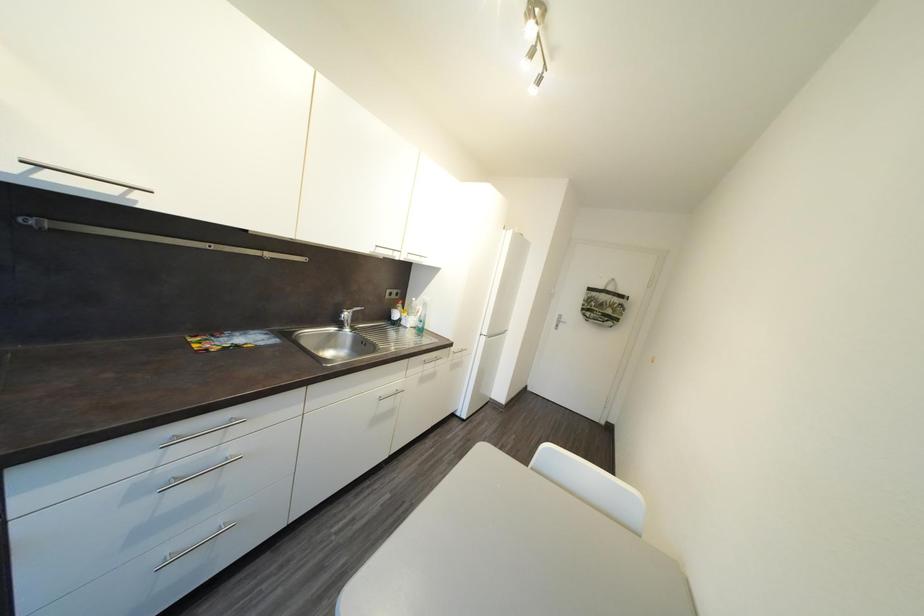
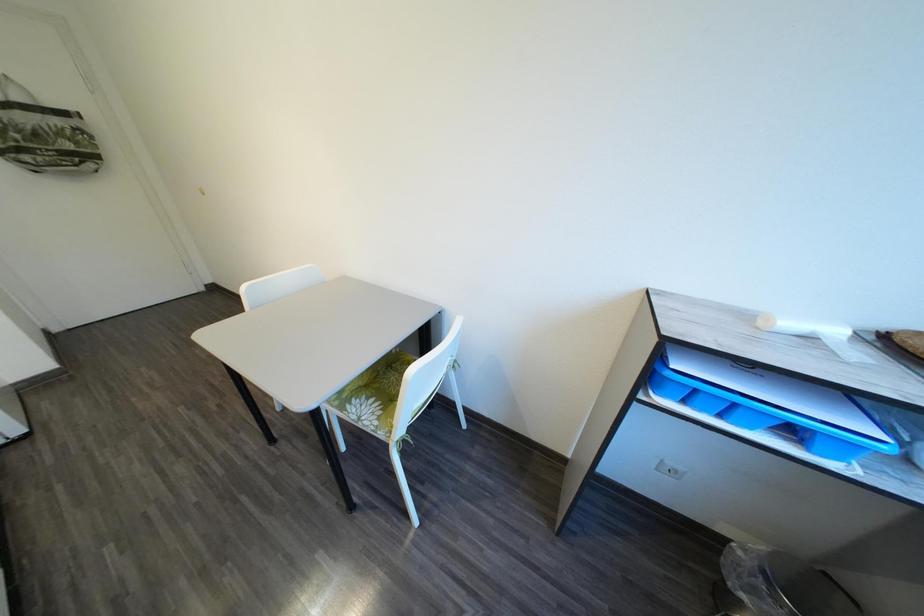
The first image is from the beginning of the video and the second image is from the end. How did the camera likely rotate when shooting the video?

The camera's rotation is toward right-down.